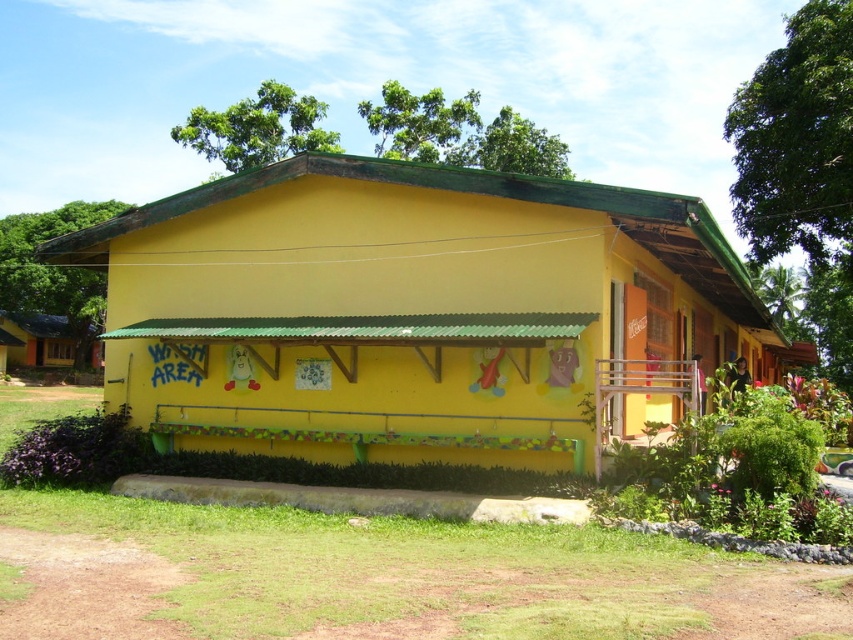
Looking at this image, how distant is yellow matte building at center from matte yellow hut at lower left?

yellow matte building at center is 58.78 meters away from matte yellow hut at lower left.

Consider the image. Does yellow matte building at center have a larger size compared to matte yellow hut at lower left?

Correct, yellow matte building at center is larger in size than matte yellow hut at lower left.

What are the coordinates of `yellow matte building at center` in the screenshot? It's located at (415, 312).

You are a GUI agent. You are given a task and a screenshot of the screen. Output one action in this format:
    pyautogui.click(x=<x>, y=<y>)
    Task: Click on the yellow matte building at center
    This screenshot has width=853, height=640.
    Given the screenshot: What is the action you would take?
    pyautogui.click(x=415, y=312)